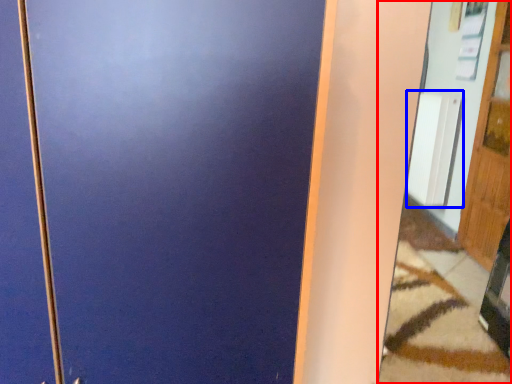
Question: Which object is further to the camera taking this photo, mirror (highlighted by a red box) or radiator (highlighted by a blue box)?

Choices:
 (A) mirror
 (B) radiator

Answer: (B)